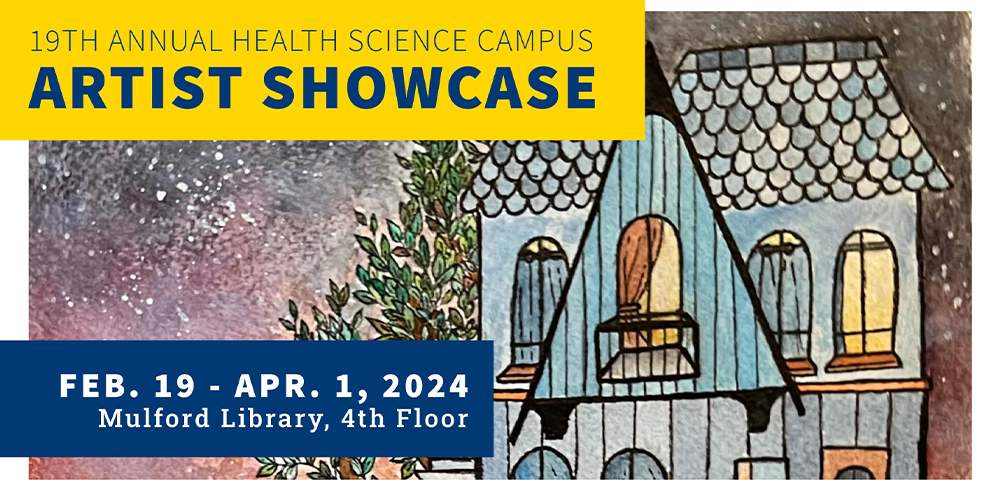
This screenshot has width=1000, height=494. Identify the location of windows. (876, 309), (797, 308), (547, 306), (660, 290), (641, 464), (554, 467), (861, 474), (774, 474).